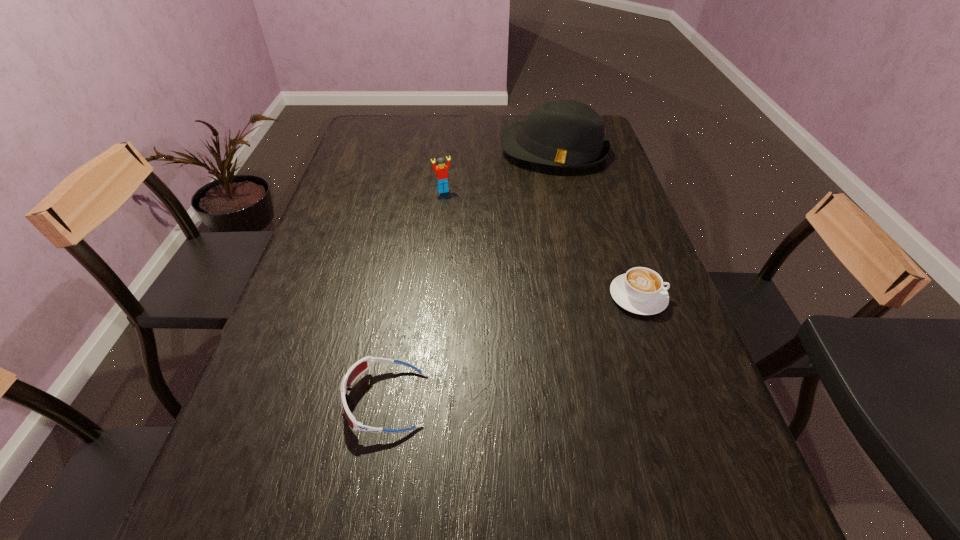
Locate an element on the screen. free point at the left edge is located at coordinates (381, 168).

I want to click on vacant space at the right edge, so click(x=598, y=189).

Find the location of a particular element. The width and height of the screenshot is (960, 540). vacant region at the near left corner of the desktop is located at coordinates (224, 458).

I want to click on free space between the third shortest object and the goggles, so click(x=415, y=295).

Image resolution: width=960 pixels, height=540 pixels. I want to click on unoccupied position between the goggles and the tallest object, so click(x=469, y=275).

Image resolution: width=960 pixels, height=540 pixels. Identify the location of free point between the nearest object and the tallest object. (469, 275).

This screenshot has width=960, height=540. I want to click on vacant area between the nearest object and the fedora, so click(469, 275).

You are a GUI agent. You are given a task and a screenshot of the screen. Output one action in this format:
    pyautogui.click(x=<x>, y=<y>)
    Task: Click on the empty space between the goggles and the cappuccino
    This screenshot has width=960, height=540.
    Given the screenshot: What is the action you would take?
    pyautogui.click(x=512, y=348)

Identify the location of blank region between the goggles and the Lego. (415, 295).

At what (x,y) coordinates should I click in order to perform the action: click on vacant area that lies between the tallest object and the cappuccino. Please return your answer as a coordinate pair (x, y). This screenshot has width=960, height=540. Looking at the image, I should click on (596, 223).